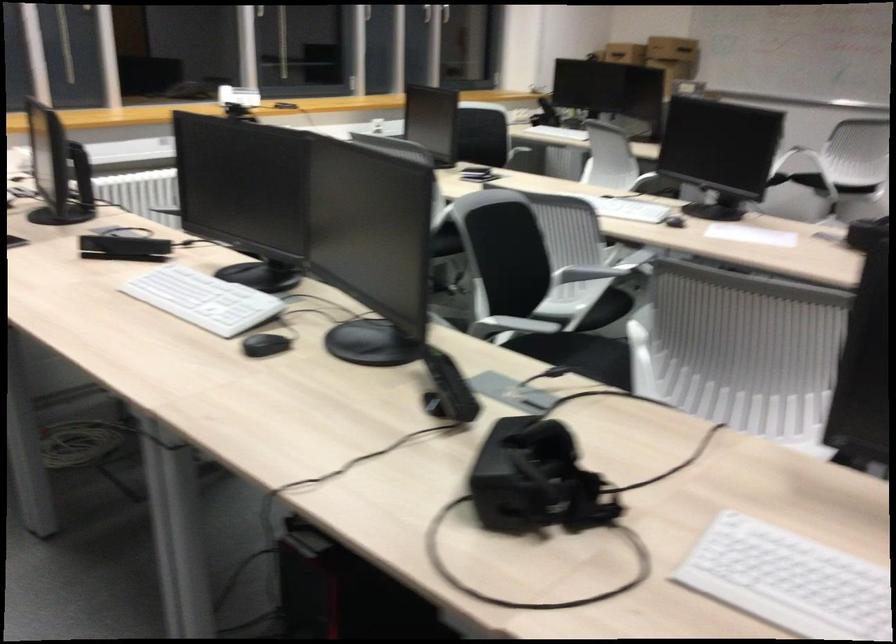
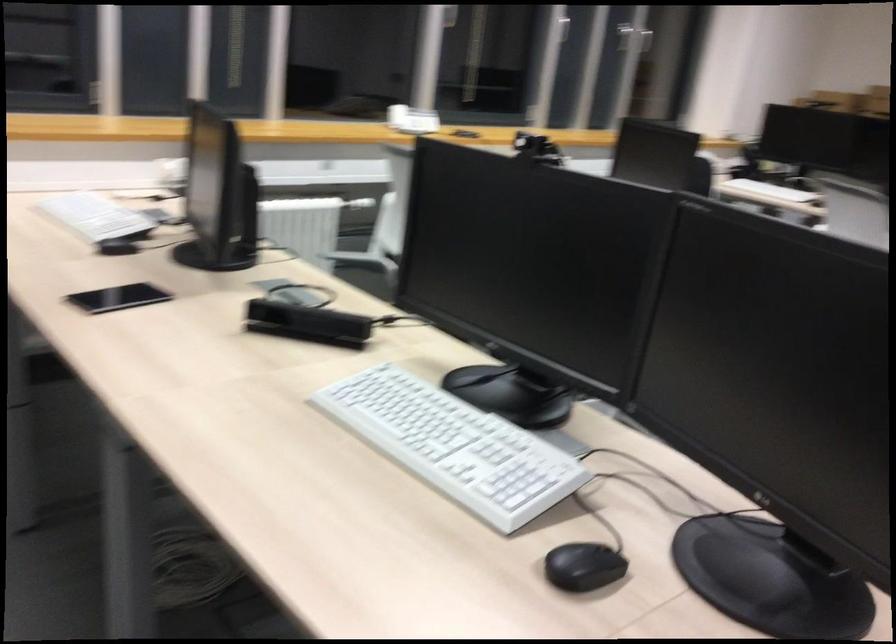
Question: The camera is either moving clockwise (left) or counter-clockwise (right) around the object. The first image is from the beginning of the video and the second image is from the end. Is the camera moving left or right when shooting the video?

Choices:
 (A) Left
 (B) Right

Answer: (B)